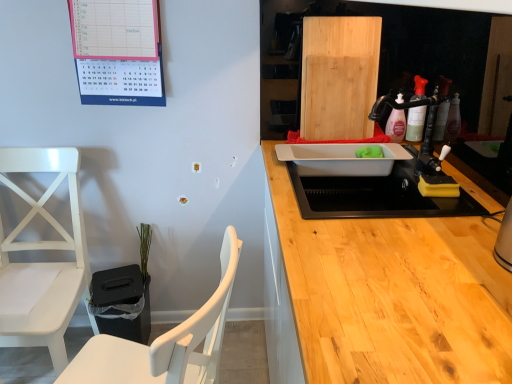
Image resolution: width=512 pixels, height=384 pixels. I want to click on natural wood cutting board at upper right, so click(x=339, y=76).

Locate an element on the screen. Image resolution: width=512 pixels, height=384 pixels. white wood chair at left, placed as the 1th chair when sorted from right to left is located at coordinates (165, 342).

This screenshot has height=384, width=512. What do you see at coordinates (376, 196) in the screenshot? I see `white plastic sink at center, the 2th sink from the back` at bounding box center [376, 196].

Find the location of a particular element. This screenshot has height=384, width=512. white plastic sink at center, the second sink positioned from the front is located at coordinates (340, 159).

Between white matte chair at left, the first chair when ordered from left to right, and pink paper calendar at upper left, which one appears on the right side from the viewer's perspective?

Positioned to the right is pink paper calendar at upper left.

Is white matte chair at left, the first chair when ordered from left to right, shorter than pink paper calendar at upper left?

No, white matte chair at left, the first chair when ordered from left to right, is not shorter than pink paper calendar at upper left.

Are white matte chair at left, which is counted as the second chair, starting from the right, and pink paper calendar at upper left making contact?

No, white matte chair at left, which is counted as the second chair, starting from the right, is not next to pink paper calendar at upper left.

Identify the location of the 1st chair below when counting from the pink paper calendar at upper left (from the image's perspective). The image size is (512, 384). (42, 263).

Can you tell me how much natural wood cutting board at upper right and pink paper calendar at upper left differ in facing direction?

The angle between the facing direction of natural wood cutting board at upper right and the facing direction of pink paper calendar at upper left is 90.5 degrees.

In the scene shown: Does natural wood cutting board at upper right have a greater width compared to pink paper calendar at upper left?

Yes, natural wood cutting board at upper right is wider than pink paper calendar at upper left.

Find the location of `bulletin board above the natural wood cutting board at upper right (from a real-world perspective)`. bulletin board above the natural wood cutting board at upper right (from a real-world perspective) is located at coordinates (118, 51).

Which object is thinner, white plastic sink at center, the 2th sink from the back, or green matte plant at lower left?

Thinner between the two is green matte plant at lower left.

Which is more to the right, white plastic sink at center, the 2th sink from the back, or green matte plant at lower left?

white plastic sink at center, the 2th sink from the back.

Is white plastic sink at center, the 2th sink from the back, facing away from green matte plant at lower left?

white plastic sink at center, the 2th sink from the back, does not have its back to green matte plant at lower left.

Between natural wood cutting board at upper right and white matte chair at left, the first chair when ordered from left to right, which one has more height?

white matte chair at left, the first chair when ordered from left to right, is taller.

Between natural wood cutting board at upper right and white matte chair at left, the first chair when ordered from left to right, which one has larger width?

With larger width is white matte chair at left, the first chair when ordered from left to right.

Does point (365, 104) come closer to viewer compared to point (4, 291)?

No, it is behind (4, 291).

Considering the sizes of pink paper calendar at upper left and green matte plant at lower left in the image, is pink paper calendar at upper left wider or thinner than green matte plant at lower left?

In the image, pink paper calendar at upper left appears to be more narrow than green matte plant at lower left.

Who is bigger, pink paper calendar at upper left or green matte plant at lower left?

Bigger between the two is pink paper calendar at upper left.

How distant is pink paper calendar at upper left from green matte plant at lower left?

pink paper calendar at upper left and green matte plant at lower left are 28.28 inches apart from each other.

Does pink paper calendar at upper left appear on the right side of green matte plant at lower left?

Correct, you'll find pink paper calendar at upper left to the right of green matte plant at lower left.

From a real-world perspective, between white matte chair at left, which is counted as the second chair, starting from the right, and green matte plant at lower left, who is vertically higher?

From a 3D spatial view, white matte chair at left, which is counted as the second chair, starting from the right, is above.

Is point (36, 203) behind point (147, 254)?

No, it is in front of (147, 254).

Is white matte chair at left, the first chair when ordered from left to right, oriented towards green matte plant at lower left?

No, white matte chair at left, the first chair when ordered from left to right, is not aimed at green matte plant at lower left.

How many degrees apart are the facing directions of white wood chair at left, which ranks as the 2th chair in left-to-right order, and green matte plant at lower left?

They differ by 106 degrees in their facing directions.

Does white wood chair at left, which ranks as the 2th chair in left-to-right order, appear on the left side of green matte plant at lower left?

Incorrect, white wood chair at left, which ranks as the 2th chair in left-to-right order, is not on the left side of green matte plant at lower left.

Is point (82, 371) farther from camera compared to point (143, 243)?

No, it is in front of (143, 243).

Where is `bulletin board above the white matte chair at left, the first chair when ordered from left to right (from the image's perspective)`? Image resolution: width=512 pixels, height=384 pixels. bulletin board above the white matte chair at left, the first chair when ordered from left to right (from the image's perspective) is located at coordinates (118, 51).

This screenshot has width=512, height=384. In order to click on plywood behind the pink paper calendar at upper left in this screenshot , I will do `click(339, 76)`.

From the image, which object appears to be farther from natural wood cutting board at upper right, white matte chair at left, which is counted as the second chair, starting from the right, or white plastic sink at center, which is counted as the 1th sink, starting from the front?

white matte chair at left, which is counted as the second chair, starting from the right.

From the image, which object appears to be farther from pink paper calendar at upper left, green matte plant at lower left or white wood chair at left, placed as the 1th chair when sorted from right to left?

white wood chair at left, placed as the 1th chair when sorted from right to left.

Estimate the real-world distances between objects in this image. Which object is further from green matte plant at lower left, pink paper calendar at upper left or white matte chair at left, the first chair when ordered from left to right?

pink paper calendar at upper left.

Based on their spatial positions, is white plastic sink at center, the 1th sink when ordered from back to front, or green matte plant at lower left closer to pink paper calendar at upper left?

white plastic sink at center, the 1th sink when ordered from back to front.

From the image, which object appears to be farther from natural wood cutting board at upper right, white matte chair at left, the first chair when ordered from left to right, or pink paper calendar at upper left?

white matte chair at left, the first chair when ordered from left to right, is positioned further to the anchor natural wood cutting board at upper right.

When comparing their distances from natural wood cutting board at upper right, does white matte chair at left, which is counted as the second chair, starting from the right, or white plastic sink at center, the second sink positioned from the front, seem further?

Based on the image, white matte chair at left, which is counted as the second chair, starting from the right, appears to be further to natural wood cutting board at upper right.

When comparing their distances from white plastic sink at center, the 1th sink when ordered from back to front, does white plastic sink at center, the 2th sink from the back, or green matte plant at lower left seem closer?

white plastic sink at center, the 2th sink from the back, is closer to white plastic sink at center, the 1th sink when ordered from back to front.

Considering their positions, is white wood chair at left, placed as the 1th chair when sorted from right to left, positioned closer to natural wood cutting board at upper right than pink paper calendar at upper left?

Based on the image, pink paper calendar at upper left appears to be nearer to natural wood cutting board at upper right.

At what (x,y) coordinates should I click in order to perform the action: click on plywood between white matte chair at left, the first chair when ordered from left to right, and white plastic sink at center, the second sink positioned from the front. Please return your answer as a coordinate pair (x, y). The height and width of the screenshot is (384, 512). Looking at the image, I should click on (339, 76).

Locate an element on the screen. Image resolution: width=512 pixels, height=384 pixels. chair between pink paper calendar at upper left and white wood chair at left, placed as the 1th chair when sorted from right to left, vertically is located at coordinates (42, 263).

At what (x,y) coordinates should I click in order to perform the action: click on chair situated between white matte chair at left, which is counted as the second chair, starting from the right, and natural wood cutting board at upper right from left to right. Please return your answer as a coordinate pair (x, y). Looking at the image, I should click on (165, 342).

Where is `chair located between white matte chair at left, which is counted as the second chair, starting from the right, and white plastic sink at center, the second sink positioned from the front, in the left-right direction`? The height and width of the screenshot is (384, 512). chair located between white matte chair at left, which is counted as the second chair, starting from the right, and white plastic sink at center, the second sink positioned from the front, in the left-right direction is located at coordinates (165, 342).